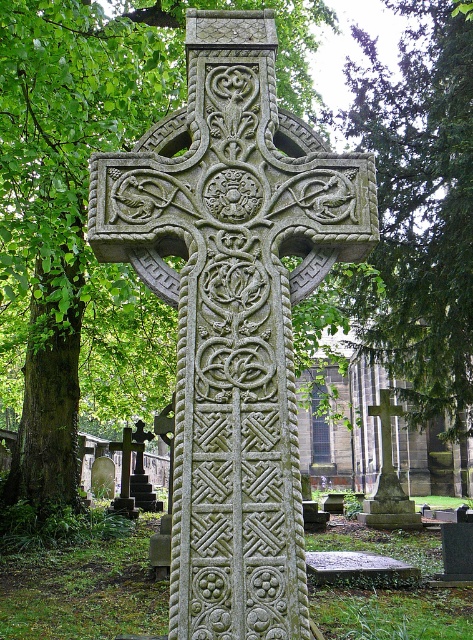
Question: Which object is farther from the camera taking this photo?

Choices:
 (A) green leafy tree at center
 (B) smooth stone cross at center

Answer: (B)

Question: Is the position of green leafy tree at center more distant than that of smooth stone cross at center?

Choices:
 (A) no
 (B) yes

Answer: (A)

Question: Can you confirm if green leafy tree at center is wider than smooth stone cross at center?

Choices:
 (A) no
 (B) yes

Answer: (B)

Question: Does green leafy tree at center have a smaller size compared to smooth stone cross at center?

Choices:
 (A) no
 (B) yes

Answer: (A)

Question: Which point is closer to the camera?

Choices:
 (A) smooth stone cross at center
 (B) green leafy tree at center

Answer: (B)